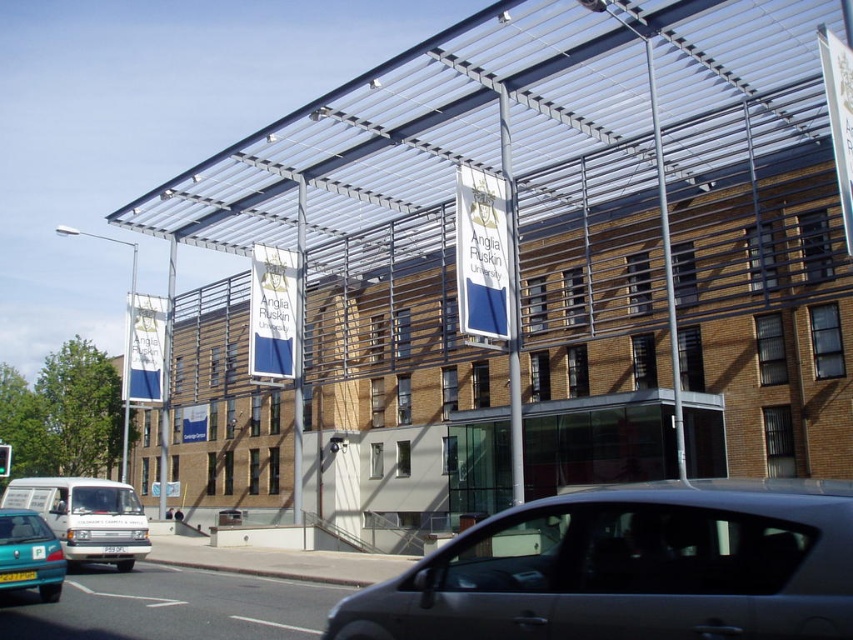
Which of these two, silver metallic car at center or white matte van at lower left, stands shorter?

With less height is silver metallic car at center.

This screenshot has height=640, width=853. What do you see at coordinates (630, 568) in the screenshot?
I see `silver metallic car at center` at bounding box center [630, 568].

Locate an element on the screen. silver metallic car at center is located at coordinates (630, 568).

Measure the distance between silver metallic car at center and teal matte hatchback at lower left.

silver metallic car at center is 9.50 meters from teal matte hatchback at lower left.

Can you confirm if silver metallic car at center is shorter than teal matte hatchback at lower left?

Indeed, silver metallic car at center has a lesser height compared to teal matte hatchback at lower left.

Find the location of a particular element. This screenshot has width=853, height=640. silver metallic car at center is located at coordinates (630, 568).

Measure the distance between white matte van at lower left and teal matte hatchback at lower left.

A distance of 3.97 meters exists between white matte van at lower left and teal matte hatchback at lower left.

Between white matte van at lower left and teal matte hatchback at lower left, which one has more height?

Standing taller between the two is white matte van at lower left.

This screenshot has width=853, height=640. I want to click on white matte van at lower left, so click(x=86, y=516).